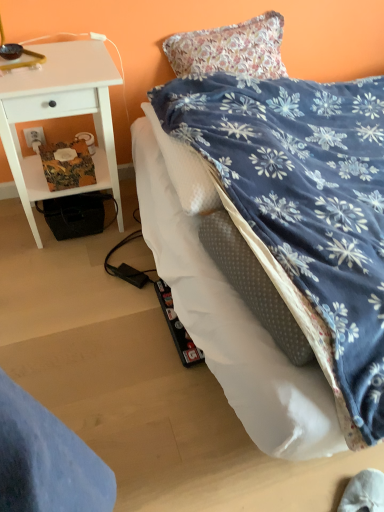
Where is `blue velvety bed at center`? This screenshot has width=384, height=512. blue velvety bed at center is located at coordinates (297, 210).

Locate an element on the screen. white wood desk at left is located at coordinates (61, 116).

Locate an element on the screen. This screenshot has width=384, height=512. bed that appears on the right of white plastic power outlet at lower left is located at coordinates (297, 210).

How distant is white plastic power outlet at lower left from blue velvety bed at center?

white plastic power outlet at lower left is 1.11 meters away from blue velvety bed at center.

Between white plastic power outlet at lower left and blue velvety bed at center, which one has smaller size?

Answer: Smaller between the two is white plastic power outlet at lower left.

Does white plastic power outlet at lower left have a lesser height compared to blue velvety bed at center?

Yes.

From the image's perspective, which one is positioned higher, white wood desk at left or white plastic power outlet at lower left?

white plastic power outlet at lower left.

Considering the sizes of objects white wood desk at left and white plastic power outlet at lower left in the image provided, who is taller, white wood desk at left or white plastic power outlet at lower left?

white wood desk at left is taller.

Find the location of a particular element. The height and width of the screenshot is (512, 384). desk to the right of white plastic power outlet at lower left is located at coordinates (61, 116).

Would you say white wood desk at left is outside white plastic power outlet at lower left?

white wood desk at left lies outside white plastic power outlet at lower left's area.

Which is more to the left, white plastic power outlet at lower left or white wood desk at left?

white plastic power outlet at lower left.

Is white wood desk at left a part of white plastic power outlet at lower left?

No.

Which object is thinner, white plastic power outlet at lower left or white wood desk at left?

white plastic power outlet at lower left.

Between blue velvety bed at center and white plastic power outlet at lower left, which one appears on the left side from the viewer's perspective?

From the viewer's perspective, white plastic power outlet at lower left appears more on the left side.

Is blue velvety bed at center far from white plastic power outlet at lower left?

Absolutely, blue velvety bed at center is distant from white plastic power outlet at lower left.

From the picture: Is blue velvety bed at center positioned in front of white plastic power outlet at lower left?

Yes.

From a real-world perspective, is blue velvety bed at center positioned above or below white plastic power outlet at lower left?

Clearly, from a real-world perspective, blue velvety bed at center is above white plastic power outlet at lower left.

Is white wood desk at left to the left of blue velvety bed at center from the viewer's perspective?

Yes, white wood desk at left is to the left of blue velvety bed at center.

Can blue velvety bed at center be found inside white wood desk at left?

That's incorrect, blue velvety bed at center is not inside white wood desk at left.

Does white wood desk at left turn towards blue velvety bed at center?

No, white wood desk at left is not aimed at blue velvety bed at center.

Between blue velvety bed at center and white wood desk at left, which one appears on the right side from the viewer's perspective?

Positioned to the right is blue velvety bed at center.

Is the position of blue velvety bed at center more distant than that of white wood desk at left?

No.

Is blue velvety bed at center located outside white wood desk at left?

Yes, blue velvety bed at center is outside of white wood desk at left.

From the image's perspective, is blue velvety bed at center positioned above or below white wood desk at left?

Clearly, from the image's perspective, blue velvety bed at center is below white wood desk at left.

You are a GUI agent. You are given a task and a screenshot of the screen. Output one action in this format:
    pyautogui.click(x=<x>, y=<y>)
    Task: Click on the bed in front of the white plastic power outlet at lower left
    
    Given the screenshot: What is the action you would take?
    pyautogui.click(x=297, y=210)

At what (x,y) coordinates should I click in order to perform the action: click on power outlet on the left of white wood desk at left. Please return your answer as a coordinate pair (x, y). This screenshot has width=384, height=512. Looking at the image, I should click on pyautogui.click(x=34, y=136).

Considering their positions, is white plastic power outlet at lower left positioned closer to blue velvety bed at center than white wood desk at left?

white wood desk at left.

Estimate the real-world distances between objects in this image. Which object is further from white wood desk at left, white plastic power outlet at lower left or blue velvety bed at center?

Among the two, blue velvety bed at center is located further to white wood desk at left.

Considering their positions, is white wood desk at left positioned further to white plastic power outlet at lower left than blue velvety bed at center?

blue velvety bed at center lies further to white plastic power outlet at lower left than the other object.

Looking at the image, which one is located closer to white plastic power outlet at lower left, blue velvety bed at center or white wood desk at left?

white wood desk at left is closer to white plastic power outlet at lower left.

Considering their positions, is white wood desk at left positioned closer to blue velvety bed at center than white plastic power outlet at lower left?

Among the two, white wood desk at left is located nearer to blue velvety bed at center.

Considering their positions, is blue velvety bed at center positioned further to white wood desk at left than white plastic power outlet at lower left?

blue velvety bed at center.

The height and width of the screenshot is (512, 384). Find the location of `desk between white plastic power outlet at lower left and blue velvety bed at center`. desk between white plastic power outlet at lower left and blue velvety bed at center is located at coordinates (61, 116).